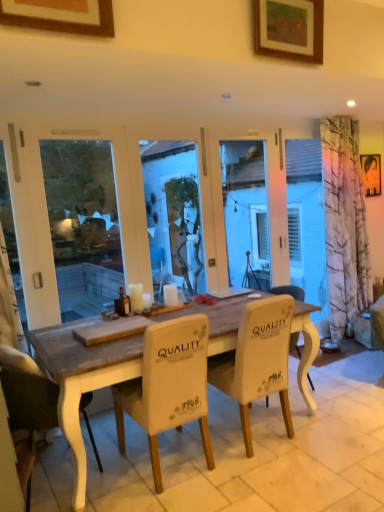
Question: Can you confirm if white fabric chair at center, which is counted as the second chair, starting from the left, is bigger than metallic silver portrait at upper right, which appears as the 1th picture frame when viewed from the back?

Choices:
 (A) yes
 (B) no

Answer: (A)

Question: Is white fabric chair at center, the 2th chair when ordered from right to left, with metallic silver portrait at upper right, the 3th picture frame viewed from the left?

Choices:
 (A) yes
 (B) no

Answer: (B)

Question: Is white fabric chair at center, which is counted as the second chair, starting from the left, at the right side of metallic silver portrait at upper right, which appears as the 1th picture frame when viewed from the back?

Choices:
 (A) no
 (B) yes

Answer: (A)

Question: Does white fabric chair at center, which is counted as the second chair, starting from the left, have a lesser height compared to metallic silver portrait at upper right, the 3th picture frame viewed from the left?

Choices:
 (A) no
 (B) yes

Answer: (A)

Question: From a real-world perspective, is white fabric chair at center, which is counted as the second chair, starting from the left, located higher than metallic silver portrait at upper right, placed as the third picture frame when sorted from front to back?

Choices:
 (A) no
 (B) yes

Answer: (A)

Question: Would you say wooden picture frame at upper center, the 2th picture frame viewed from the left, is inside or outside metallic silver portrait at upper right, the 1th picture frame in the right-to-left sequence?

Choices:
 (A) outside
 (B) inside

Answer: (A)

Question: From a real-world perspective, is wooden picture frame at upper center, the 2th picture frame positioned from the right, above or below metallic silver portrait at upper right, the 3th picture frame viewed from the left?

Choices:
 (A) below
 (B) above

Answer: (B)

Question: Is point (271, 39) positioned closer to the camera than point (362, 166)?

Choices:
 (A) farther
 (B) closer

Answer: (B)

Question: From the image's perspective, is wooden picture frame at upper center, arranged as the 2th picture frame when viewed from the back, located above or below metallic silver portrait at upper right, which appears as the 1th picture frame when viewed from the back?

Choices:
 (A) below
 (B) above

Answer: (B)

Question: Considering the positions of wooden picture frame at upper center, the 2th picture frame viewed from the left, and white fabric chair at center, the third chair viewed from the left, in the image, is wooden picture frame at upper center, the 2th picture frame viewed from the left, bigger or smaller than white fabric chair at center, the third chair viewed from the left,?

Choices:
 (A) big
 (B) small

Answer: (B)

Question: Does point (316, 17) appear closer or farther from the camera than point (238, 343)?

Choices:
 (A) farther
 (B) closer

Answer: (B)

Question: In the image, is wooden picture frame at upper center, the 2th picture frame viewed from the left, positioned in front of or behind white fabric chair at center, which is the first chair in right-to-left order?

Choices:
 (A) behind
 (B) front

Answer: (B)

Question: From a real-world perspective, is wooden picture frame at upper center, the 2th picture frame viewed from the left, positioned above or below white fabric chair at center, which is the first chair in right-to-left order?

Choices:
 (A) below
 (B) above

Answer: (B)

Question: In terms of width, does white fabric chair at center, the 2th chair when ordered from right to left, look wider or thinner when compared to wooden picture frame at upper center, which is the 3th picture frame in back-to-front order?

Choices:
 (A) thin
 (B) wide

Answer: (B)

Question: Is point tap(145, 340) closer or farther from the camera than point tap(26, 0)?

Choices:
 (A) closer
 (B) farther

Answer: (B)